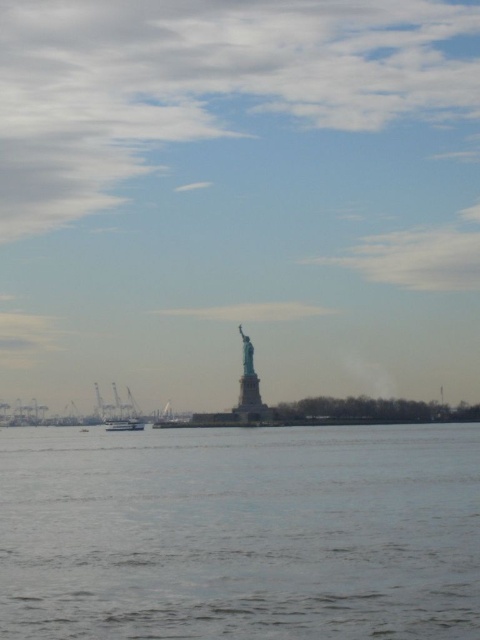
Does white glossy boat at lower left come in front of white plastic boat at center?

No, white glossy boat at lower left is further to the viewer.

Locate an element on the screen. white glossy boat at lower left is located at coordinates point(123,413).

Measure the distance between clear water at center and camera.

They are 21.66 meters apart.

Who is more forward, (247, 595) or (247, 369)?

Point (247, 595)

Where is `clear water at center`? This screenshot has width=480, height=640. clear water at center is located at coordinates (240, 532).

Can you confirm if clear water at center is thinner than white plastic boat at center?

Incorrect, clear water at center's width is not less than white plastic boat at center's.

Does clear water at center have a greater width compared to white plastic boat at center?

Indeed, clear water at center has a greater width compared to white plastic boat at center.

Is point (79, 602) closer to camera compared to point (127, 419)?

Yes, it is.

This screenshot has width=480, height=640. Identify the location of clear water at center. click(x=240, y=532).